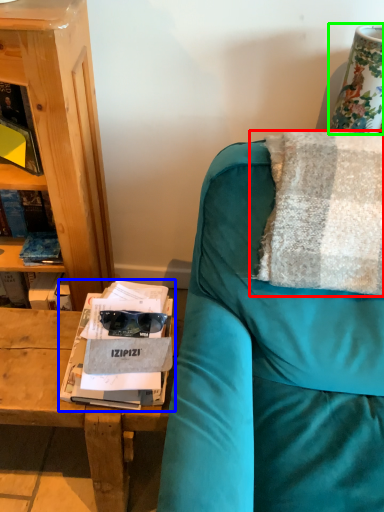
Question: Which is farther away from pillow (highlighted by a red box)? magazine (highlighted by a blue box) or table lamp (highlighted by a green box)?

Choices:
 (A) magazine
 (B) table lamp

Answer: (A)